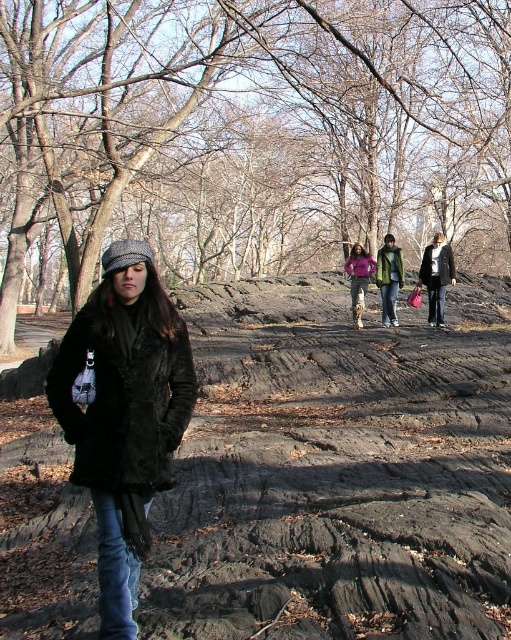
Who is shorter, dark gray woolen coat at center or green matte jacket at center?

green matte jacket at center is shorter.

Is point (447, 246) in front of point (377, 272)?

Yes, it is.

The image size is (511, 640). Identify the location of dark gray woolen coat at center. (436, 276).

Can you confirm if dark brown textured dirt track at center is positioned below dark gray woolen coat at center?

Correct, dark brown textured dirt track at center is located below dark gray woolen coat at center.

Is point (44, 468) more distant than point (452, 273)?

That is False.

This screenshot has height=640, width=511. I want to click on dark brown textured dirt track at center, so click(x=337, y=468).

In the scene shown: Who is more distant from viewer, (69, 438) or (376, 269)?

The point (376, 269) is behind.

Between dark brown fur coat at center and green matte jacket at center, which one has less height?

With less height is green matte jacket at center.

Where is `dark brown fur coat at center`? The width and height of the screenshot is (511, 640). dark brown fur coat at center is located at coordinates (124, 413).